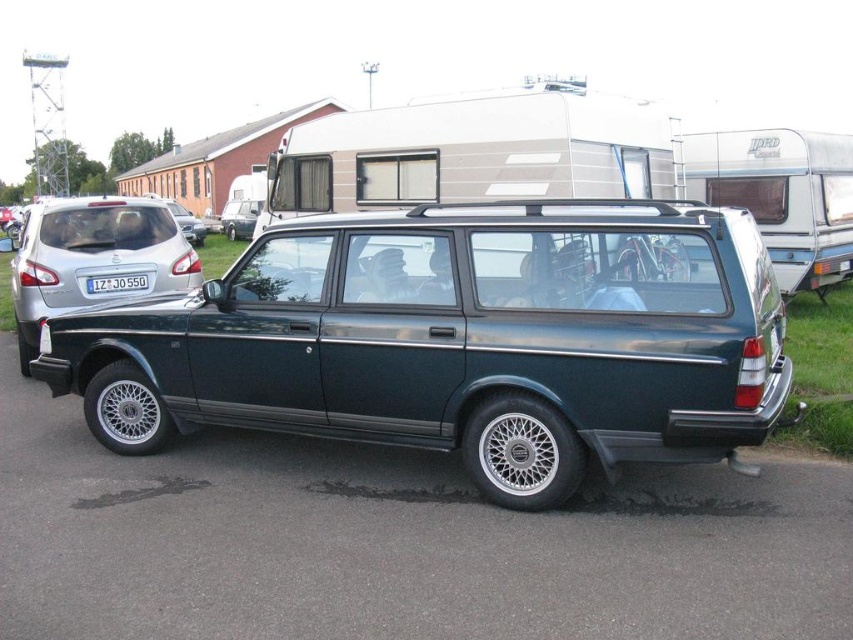
Question: Observing the image, what is the correct spatial positioning of metallic green station wagon at center in reference to matte silver car at upper left?

Choices:
 (A) right
 (B) left

Answer: (A)

Question: Does metallic silver car at left have a larger size compared to matte silver car at upper left?

Choices:
 (A) yes
 (B) no

Answer: (B)

Question: Can you confirm if metallic silver pickup truck at upper right is wider than matte silver car at upper left?

Choices:
 (A) yes
 (B) no

Answer: (B)

Question: Which of the following is the closest to the observer?

Choices:
 (A) metallic silver car at left
 (B) matte silver car at upper left
 (C) metallic silver pickup truck at upper right
 (D) white plastic license plate at center

Answer: (A)

Question: Among these points, which one is nearest to the camera?

Choices:
 (A) [727, 172]
 (B) [115, 284]

Answer: (B)

Question: Among these objects, which one is farthest from the camera?

Choices:
 (A) metallic green station wagon at center
 (B) metallic silver pickup truck at upper right
 (C) white plastic license plate at center
 (D) matte silver car at upper left

Answer: (B)